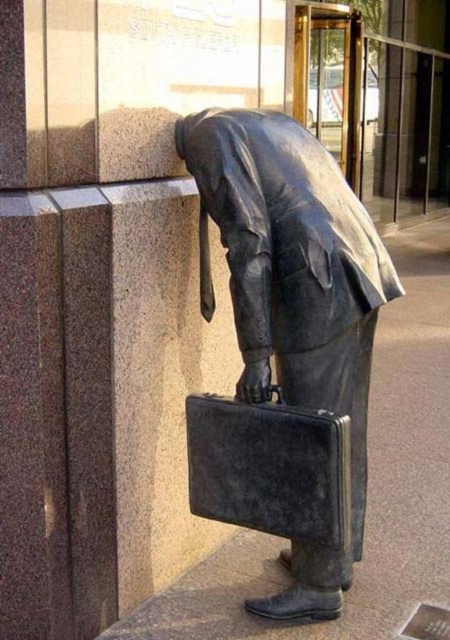
Question: Is bronze statue at center further to camera compared to black leather briefcase at center?

Choices:
 (A) no
 (B) yes

Answer: (B)

Question: Does bronze statue at center appear over black leather briefcase at center?

Choices:
 (A) yes
 (B) no

Answer: (A)

Question: In this image, where is bronze statue at center located relative to black leather briefcase at center?

Choices:
 (A) below
 (B) above

Answer: (B)

Question: Which point is farther from the camera taking this photo?

Choices:
 (A) (301, 493)
 (B) (265, 129)

Answer: (B)